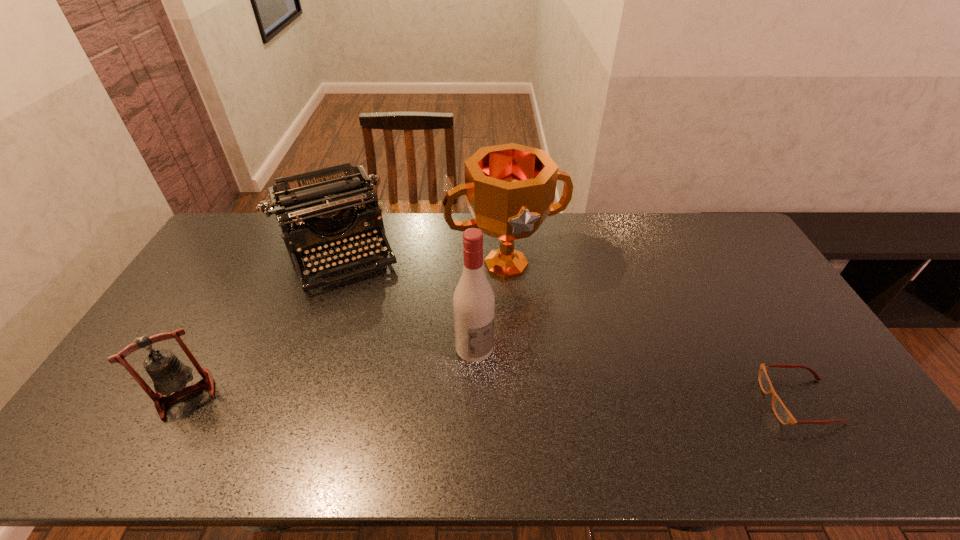
Where is `vacant area situated on the typing side of the typewriter`? The height and width of the screenshot is (540, 960). vacant area situated on the typing side of the typewriter is located at coordinates (383, 357).

I want to click on vacant region located on the typing side of the typewriter, so click(360, 305).

I want to click on free space located 0.180m on the typing side of the typewriter, so click(372, 330).

The width and height of the screenshot is (960, 540). I want to click on free location located 0.140m on the side of the award with the star emblem, so click(x=541, y=323).

Where is `vacant space located on the side of the award with the star emblem`? The height and width of the screenshot is (540, 960). vacant space located on the side of the award with the star emblem is located at coordinates (547, 333).

Locate an element on the screen. Image resolution: width=960 pixels, height=540 pixels. free space located 0.230m on the side of the award with the star emblem is located at coordinates (554, 346).

Identify the location of vacant position located on the label of the alcohol. Image resolution: width=960 pixels, height=540 pixels. (518, 396).

Find the location of a particular element. vacant space located 0.220m on the label of the alcohol is located at coordinates (540, 418).

Identify the location of vacant space located on the label of the alcohol. This screenshot has height=540, width=960. (516, 393).

Find the location of a particular element. This screenshot has width=960, height=540. typewriter present at the far edge is located at coordinates (319, 201).